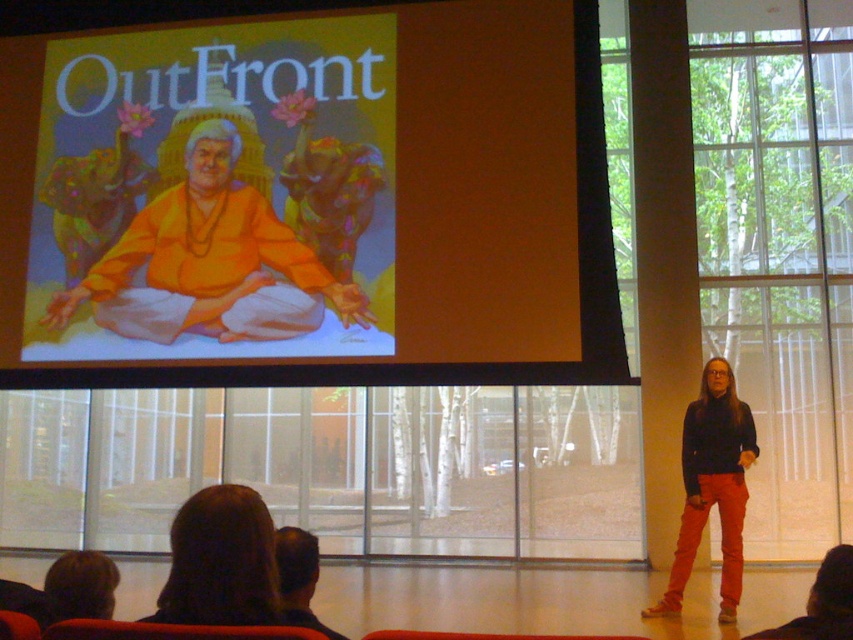
Question: Which point is farther from the camera taking this photo?

Choices:
 (A) (177, 534)
 (B) (729, 378)
 (C) (285, 582)
 (D) (850, 586)

Answer: (B)

Question: Is brown hair at lower center wider than dark brown hair at lower left?

Choices:
 (A) no
 (B) yes

Answer: (B)

Question: Among these points, which one is nearest to the camera?

Choices:
 (A) (712, 388)
 (B) (256, 547)
 (C) (233, 208)
 (D) (839, 602)

Answer: (B)

Question: Can you confirm if matte orange poster at center is thinner than brown hair at lower center?

Choices:
 (A) yes
 (B) no

Answer: (B)

Question: Which point is farther to the camera?

Choices:
 (A) dark brown hair at lower left
 (B) matte orange fabric at center
 (C) matte orange poster at center
 (D) brown hair at lower right

Answer: (B)

Question: Can you confirm if matte orange poster at center is thinner than dark brown hair at lower left?

Choices:
 (A) yes
 (B) no

Answer: (B)